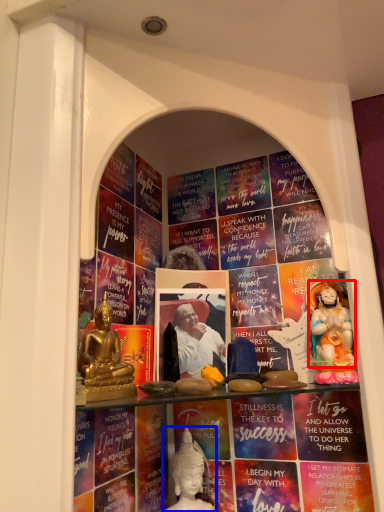
Question: Which object appears farthest to the camera in this image, person (highlighted by a red box) or person (highlighted by a blue box)?

Choices:
 (A) person
 (B) person

Answer: (B)